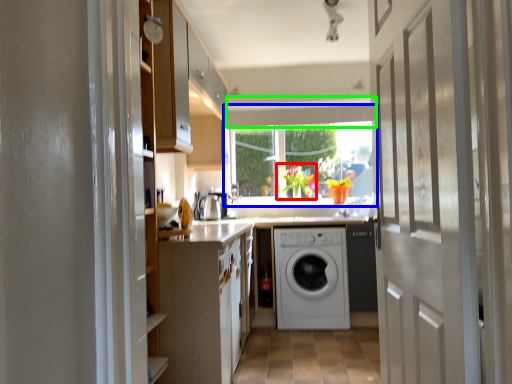
Question: Which is nearer to the floral arrangement (highlighted by a red box)? window (highlighted by a blue box) or exhaust hood (highlighted by a green box).

Choices:
 (A) window
 (B) exhaust hood

Answer: (A)